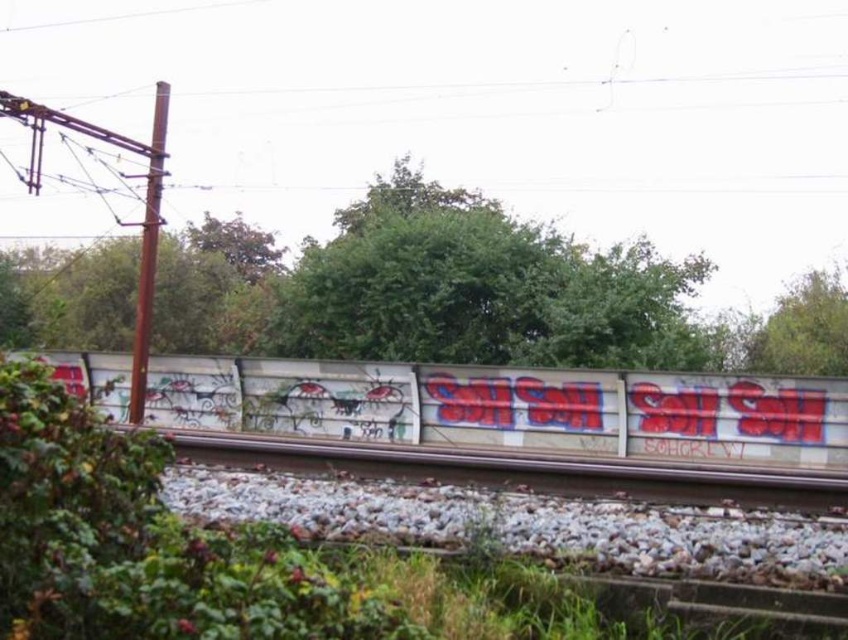
Is green leafy tree at center wider than white concrete train track at center?

Correct, the width of green leafy tree at center exceeds that of white concrete train track at center.

Who is higher up, green leafy tree at center or white concrete train track at center?

green leafy tree at center is above.

In the scene shown: Measure the distance between green leafy tree at center and camera.

20.14 meters

This screenshot has height=640, width=848. Identify the location of green leafy tree at center. (472, 292).

Is green leafy tree at center above green leafy tree at upper right?

Indeed, green leafy tree at center is positioned over green leafy tree at upper right.

Locate an element on the screen. This screenshot has height=640, width=848. green leafy tree at center is located at coordinates (472, 292).

Does point (177, 346) come closer to viewer compared to point (826, 298)?

Yes, point (177, 346) is closer to viewer.

This screenshot has height=640, width=848. What are the coordinates of `green leafy tree at center` in the screenshot? It's located at (472, 292).

Is green leafy tree at center positioned at the back of white graffiti wall at center?

Yes, it is behind white graffiti wall at center.

The image size is (848, 640). What do you see at coordinates (472, 292) in the screenshot? I see `green leafy tree at center` at bounding box center [472, 292].

Describe the element at coordinates (472, 292) in the screenshot. I see `green leafy tree at center` at that location.

Find the location of a particular element. The width and height of the screenshot is (848, 640). green leafy tree at center is located at coordinates (472, 292).